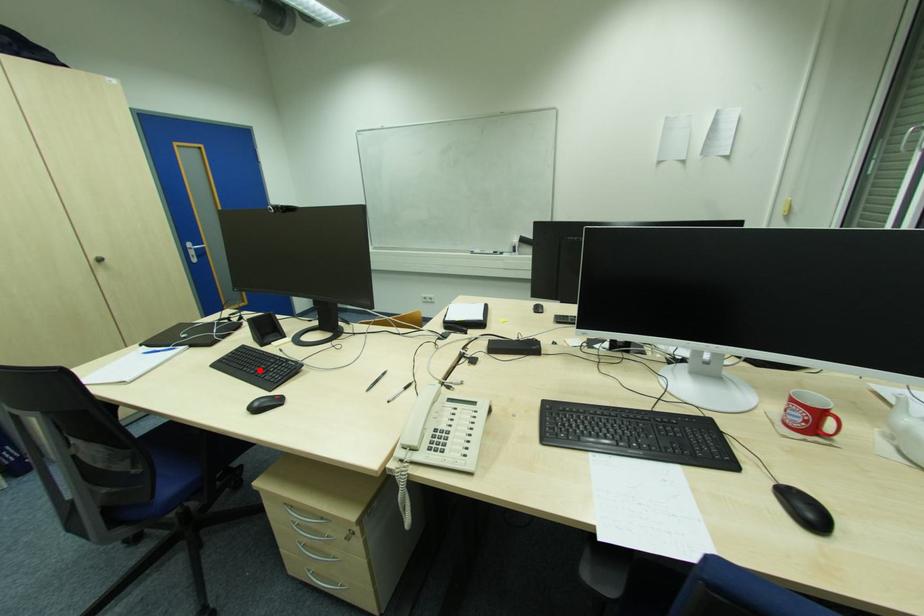
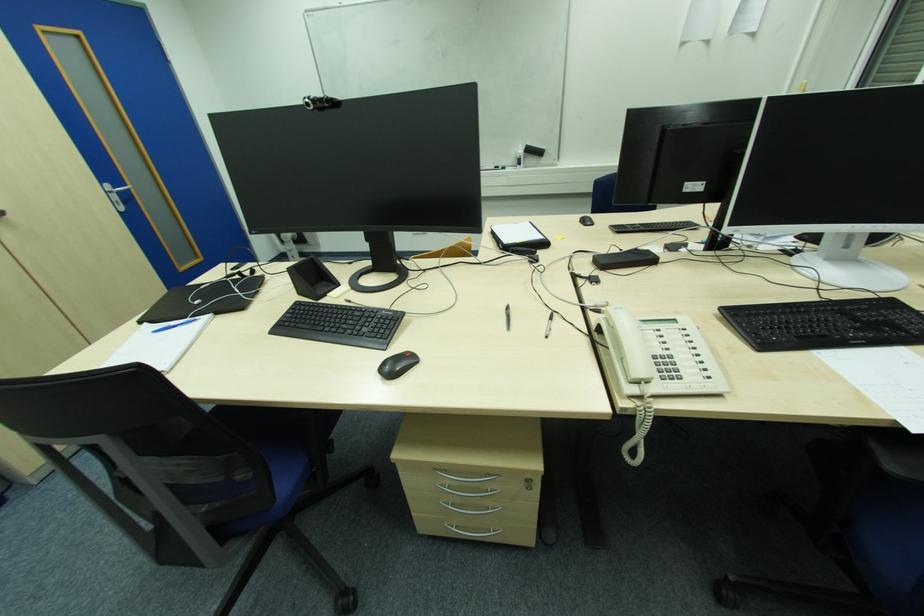
Question: I am providing you with two images of the same scene from different viewpoints. A red point is marked on the first image. Is the red point's position out of view in image 2?

Choices:
 (A) Yes
 (B) No

Answer: (B)